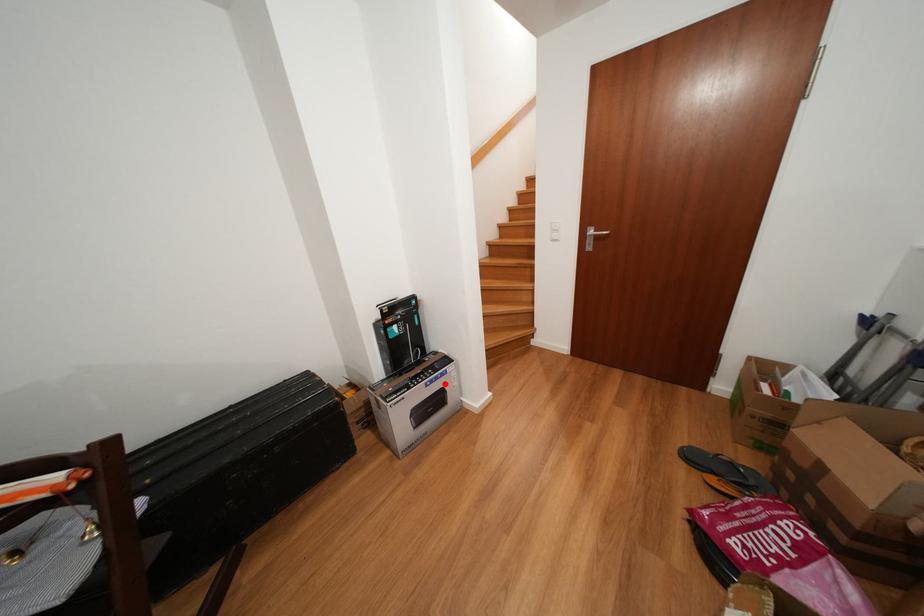
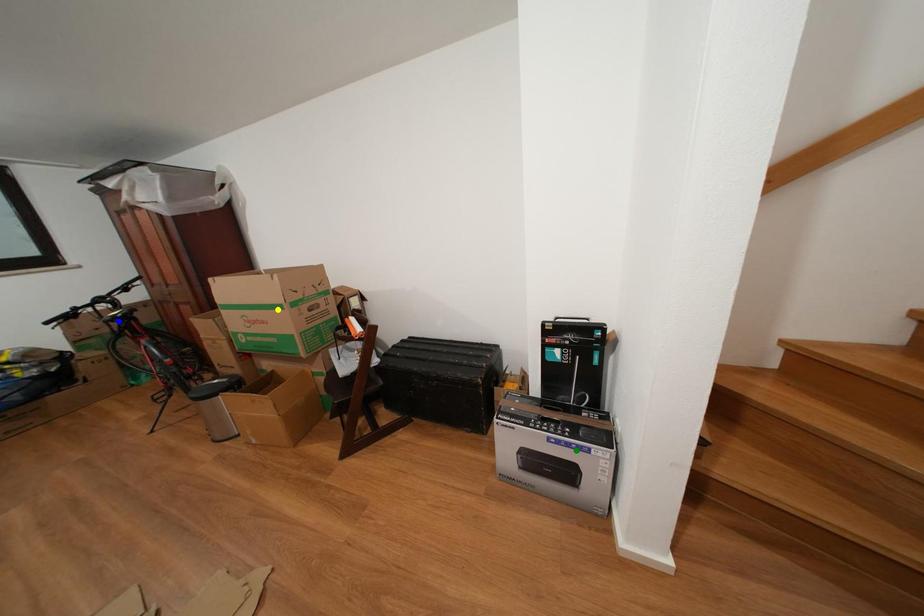
Question: I am providing you with two images of the same scene from different viewpoints. A red point is marked on the first image. You are given multiple points on the second image. Can you choose the point in image 2 that corresponds to the point in image 1?

Choices:
 (A) blue point
 (B) green point
 (C) yellow point

Answer: (B)